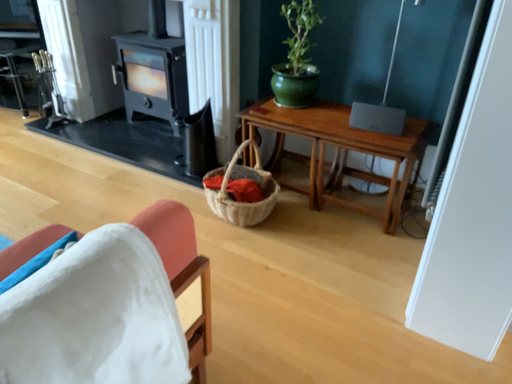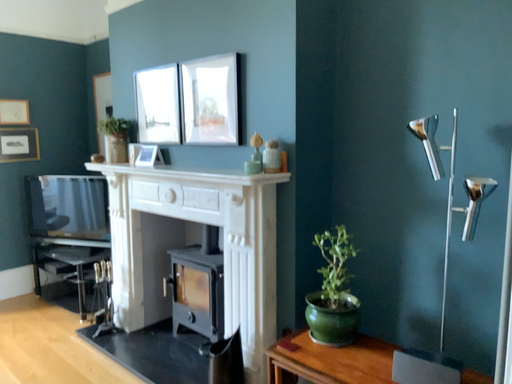
Question: Which way did the camera rotate in the video?

Choices:
 (A) rotated downward
 (B) rotated upward

Answer: (B)